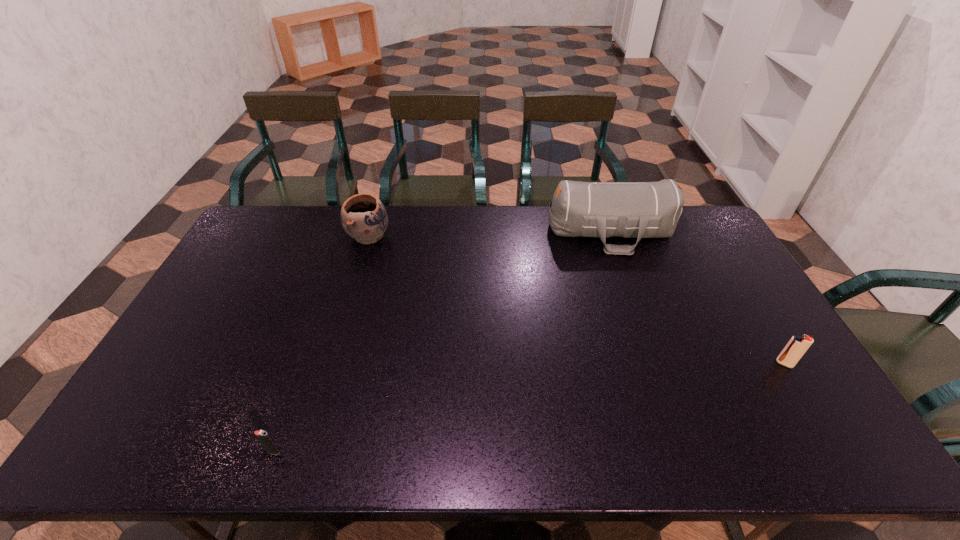
Where is `free point located 0.070m on the left of the nearest object`? This screenshot has width=960, height=540. free point located 0.070m on the left of the nearest object is located at coordinates (236, 452).

In order to click on duffel bag that is at the far edge in this screenshot , I will do `click(639, 210)`.

Where is `pottery that is at the far edge`? The width and height of the screenshot is (960, 540). pottery that is at the far edge is located at coordinates (363, 216).

This screenshot has height=540, width=960. I want to click on object present at the near edge, so click(264, 438).

Locate an element on the screen. Image resolution: width=960 pixels, height=540 pixels. duffel bag that is at the right edge is located at coordinates (639, 210).

I want to click on igniter that is at the right edge, so click(x=797, y=346).

This screenshot has width=960, height=540. In order to click on object present at the far right corner in this screenshot , I will do pos(639,210).

In order to click on vacant space at the far edge of the desktop in this screenshot , I will do `click(456, 230)`.

Find the location of a particular element. Image resolution: width=960 pixels, height=540 pixels. free space at the near edge of the desktop is located at coordinates (239, 443).

Image resolution: width=960 pixels, height=540 pixels. In the image, there is a desktop. Identify the location of vacant space at the left edge. (233, 280).